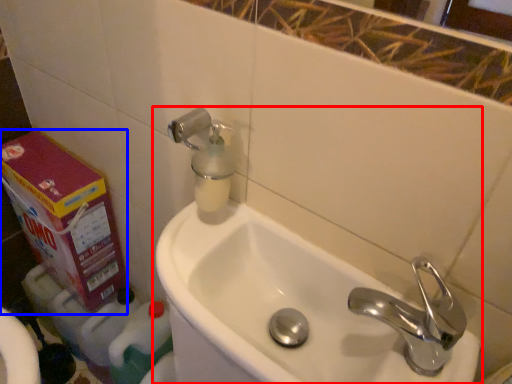
Question: Which object is further to the camera taking this photo, sink (highlighted by a red box) or carton (highlighted by a blue box)?

Choices:
 (A) sink
 (B) carton

Answer: (B)